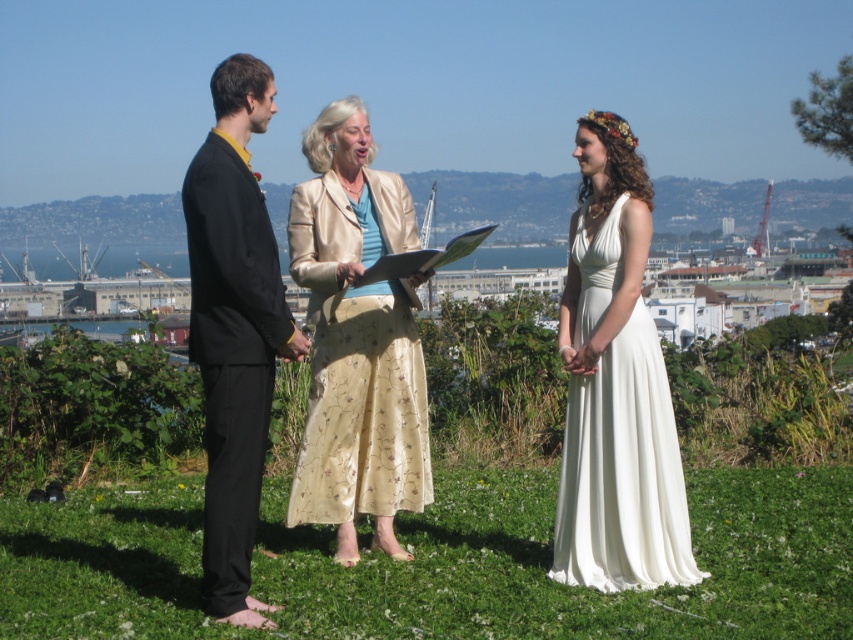
Is satin beige skirt at center positioned in front of ivory satin dress at center?

No.

Is the position of satin beige skirt at center more distant than that of ivory satin dress at center?

Yes, satin beige skirt at center is further from the viewer.

Does point (399, 285) come behind point (642, 570)?

Yes, point (399, 285) is behind point (642, 570).

Locate an element on the screen. The height and width of the screenshot is (640, 853). satin beige skirt at center is located at coordinates point(357,340).

Can you confirm if matte black suit at left is wider than black satin suit at left?

In fact, matte black suit at left might be narrower than black satin suit at left.

Does point (326, 122) come behind point (209, 88)?

No, it is in front of (209, 88).

Locate an element on the screen. The image size is (853, 640). matte black suit at left is located at coordinates (357, 339).

Where is `matte black suit at left`? This screenshot has height=640, width=853. matte black suit at left is located at coordinates (357, 339).

Can you confirm if black satin suit at left is positioned to the left of ivory satin dress at center?

Correct, you'll find black satin suit at left to the left of ivory satin dress at center.

Does point (251, 218) come behind point (683, 556)?

No, (251, 218) is closer to viewer.

Where is `black satin suit at left`? This screenshot has height=640, width=853. black satin suit at left is located at coordinates (234, 330).